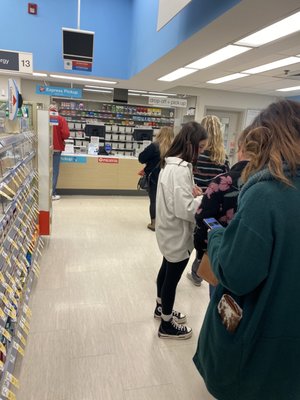
You are a GUI agent. You are given a task and a screenshot of the screen. Output one action in this format:
    pyautogui.click(x=<x>, y=<y>)
    Task: Click on the wall above counter
    
    Given the screenshot: What is the action you would take?
    pyautogui.click(x=105, y=63)